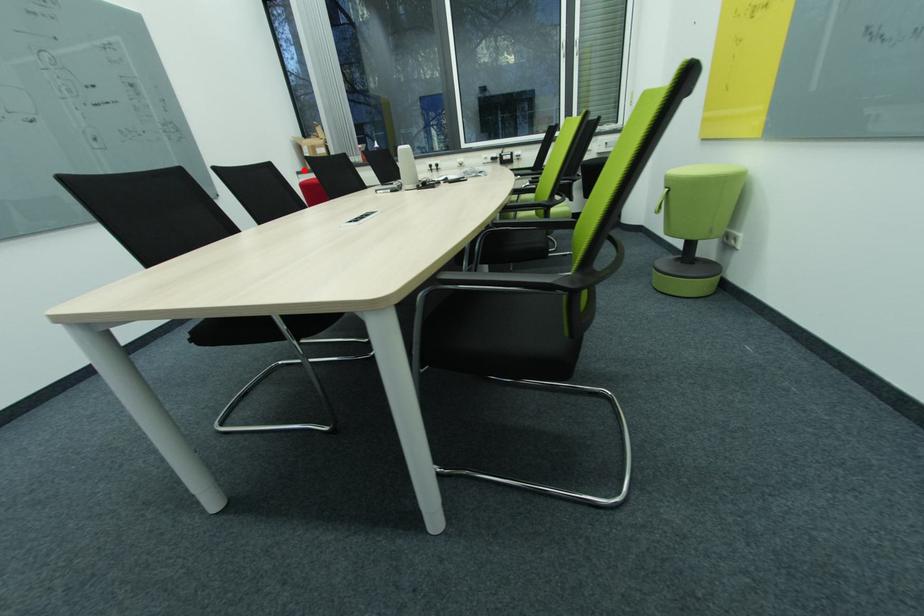
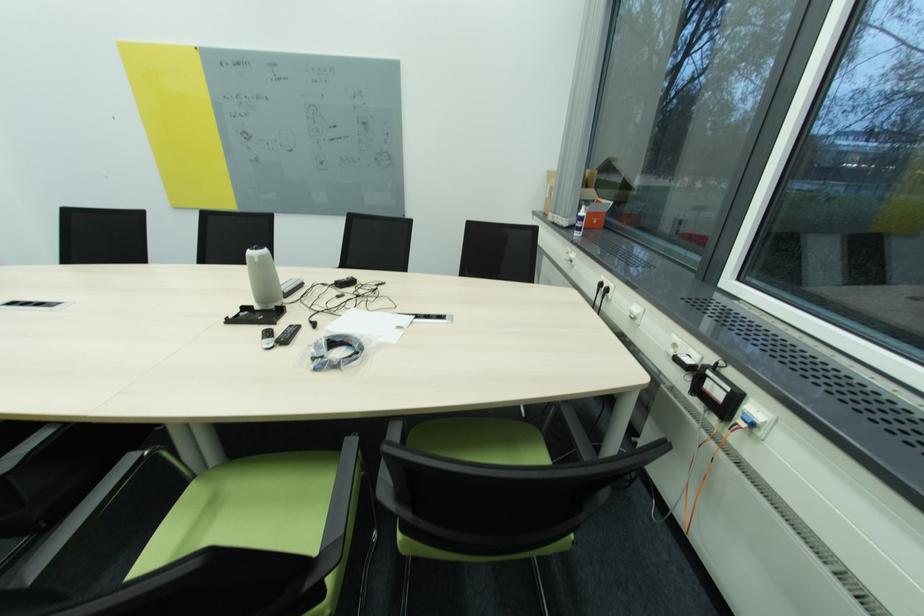
Locate, in the second image, the point that corresponds to the highlighted location in the first image.

(544, 209)